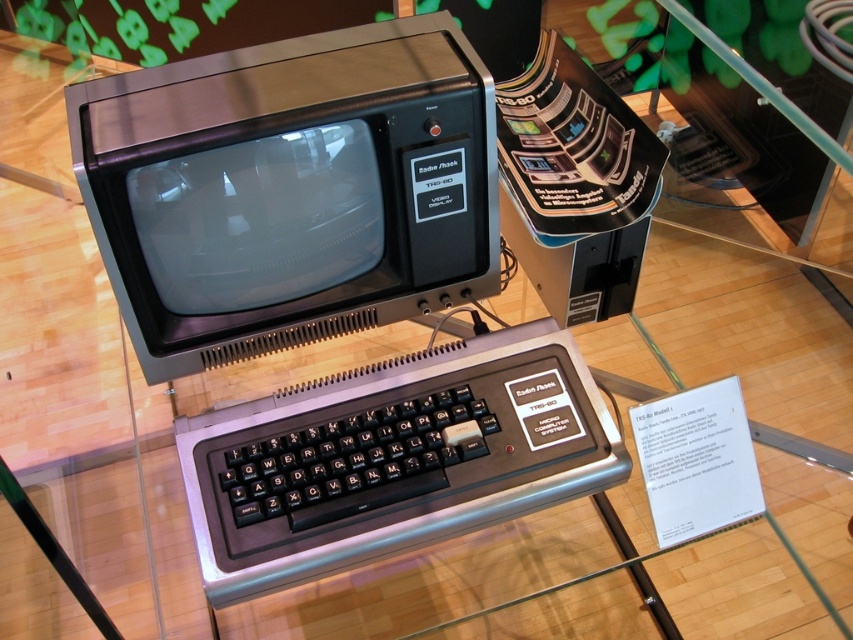
In the scene shown: You are a museum guide explaining the layout of the vintage Radio Shack TRS 80 Model I computer to a visitor. You point to the matte black monitor at center and the black plastic keyboard at center. Which object is located to the left of the other?

The matte black monitor at center is positioned on the left side of black plastic keyboard at center.

Looking at this image, you are a museum visitor observing the vintage Radio Shack TRS 80 Model I computer. You notice the matte black monitor at center and the black plastic keyboard at center. Which object would block your view of a small label placed directly behind the larger object?

The matte black monitor at center is bigger than the black plastic keyboard at center, so the matte black monitor at center would block your view of the small label placed directly behind it.

Consider the image. You are a visitor at the museum and want to take a photo of the matte black monitor at center. The museum allows photos but requires you to stand exactly at point (289, 189) to capture the best angle. Can you confirm if standing at that point will let you see the matte black monitor at center clearly?

Yes, standing at point (289, 189) will allow you to see the matte black monitor at center clearly as that is precisely where it is located.